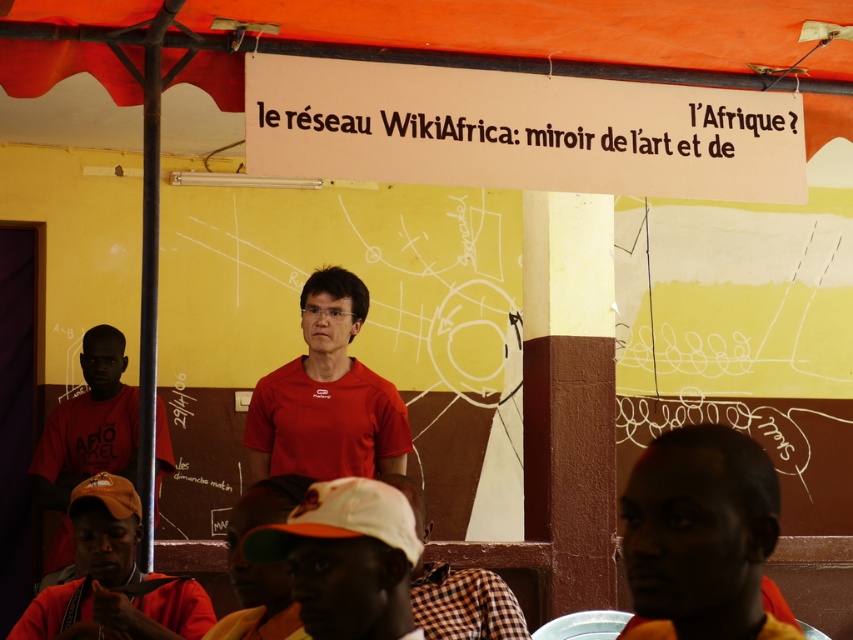
Question: Which object is the farthest from the matte orange shirt at lower right?

Choices:
 (A) checkered fabric shirt at center
 (B) orange fabric canopy at upper center
 (C) black paper sign at upper center
 (D) matte red shirt at lower left

Answer: (D)

Question: Which of the following is the closest to the observer?

Choices:
 (A) click(x=747, y=472)
 (B) click(x=323, y=524)
 (C) click(x=50, y=508)
 (D) click(x=117, y=618)

Answer: (A)

Question: Does matte orange shirt at lower right have a greater width compared to checkered fabric shirt at center?

Choices:
 (A) no
 (B) yes

Answer: (A)

Question: In this image, where is matte red shirt at center located relative to orange fabric cap at lower left?

Choices:
 (A) left
 (B) right

Answer: (B)

Question: Is orange fabric canopy at upper center to the left of white matte cap at lower center from the viewer's perspective?

Choices:
 (A) yes
 (B) no

Answer: (B)

Question: Estimate the real-world distances between objects in this image. Which object is farther from the black paper sign at upper center?

Choices:
 (A) matte orange shirt at lower right
 (B) matte red shirt at center
 (C) checkered fabric shirt at center

Answer: (A)